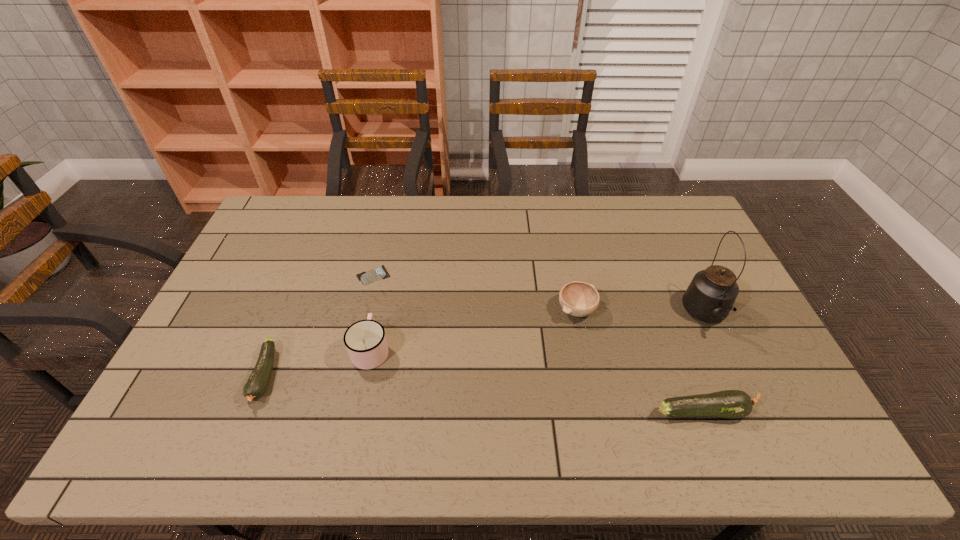
The image size is (960, 540). What are the coordinates of `unoccupied area between the kettle and the second tallest object` in the screenshot? It's located at (539, 333).

Image resolution: width=960 pixels, height=540 pixels. Find the location of `blank region between the bowl and the right zucchini`. blank region between the bowl and the right zucchini is located at coordinates (639, 361).

The width and height of the screenshot is (960, 540). Identify the location of free area in between the fourth object from left to right and the identity card. (475, 293).

Where is `empty location between the identity card and the taller zucchini`? The image size is (960, 540). empty location between the identity card and the taller zucchini is located at coordinates (538, 343).

Choose which object is the fourth nearest neighbor to the bowl. Please provide its 2D coordinates. Your answer should be formatted as a tuple, i.e. [(x, y)], where the tuple contains the x and y coordinates of a point satisfying the conditions above.

[(379, 273)]

Where is `the fifth closest object relative to the second tallest object`? the fifth closest object relative to the second tallest object is located at coordinates (710, 296).

You are a GUI agent. You are given a task and a screenshot of the screen. Output one action in this format:
    pyautogui.click(x=<x>, y=<y>)
    Task: Click on the vacant point that satisfies the following two spatial constraints: 1. spout on the kettle; 2. at the blossom end of the right zucchini
    The height and width of the screenshot is (540, 960).
    Given the screenshot: What is the action you would take?
    pyautogui.click(x=751, y=411)

The width and height of the screenshot is (960, 540). Find the location of `free space that satisfies the following two spatial constraints: 1. spout on the kettle; 2. at the blossom end of the right zucchini`. free space that satisfies the following two spatial constraints: 1. spout on the kettle; 2. at the blossom end of the right zucchini is located at coordinates coord(751,411).

Identify the location of free space that satisfies the following two spatial constraints: 1. on the side of the mug with the handle; 2. on the left side of the third object from right to left. The image size is (960, 540). (379, 310).